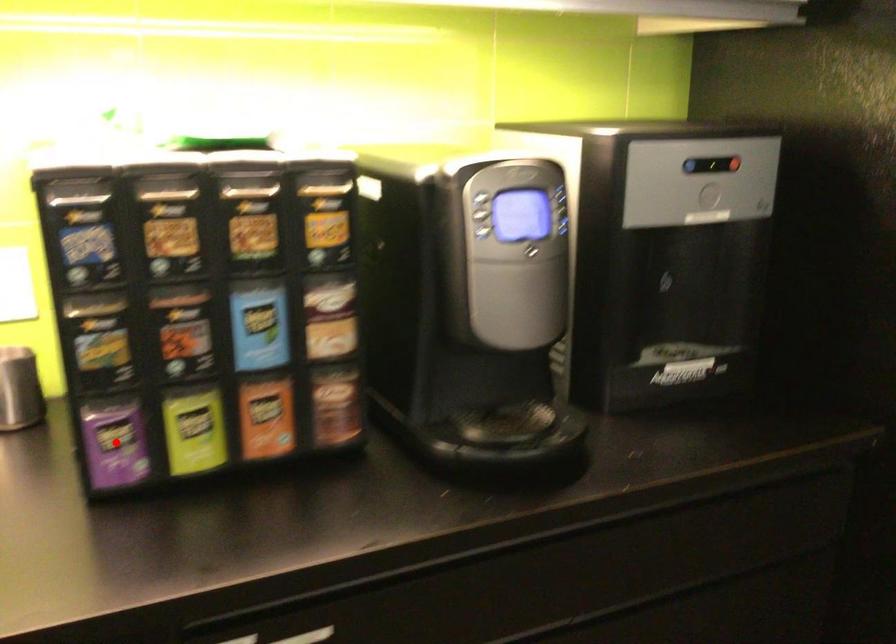
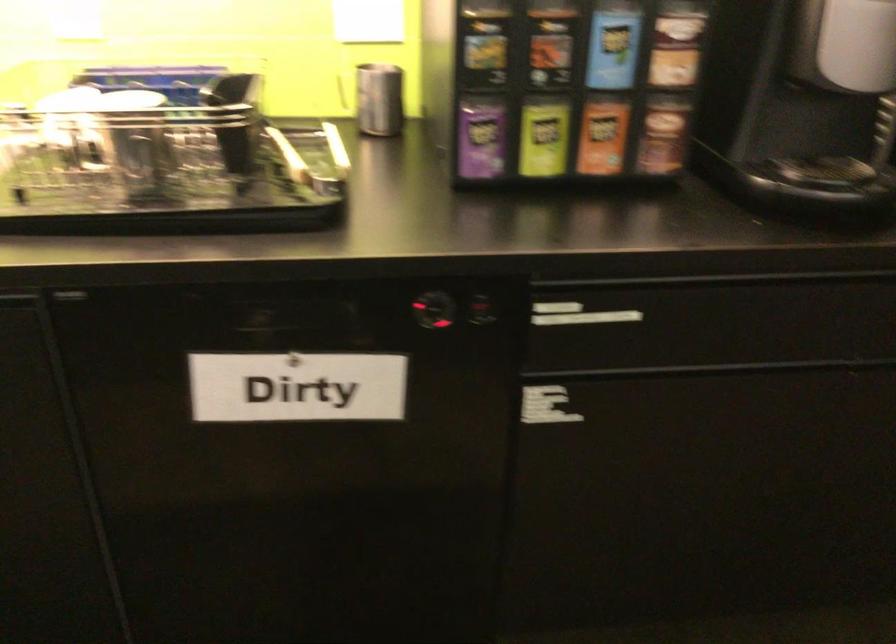
Question: A red point is marked in image1. In image2, is the corresponding 3D point closer to the camera or farther? Reply with the corresponding letter.

Choices:
 (A) The corresponding 3D point is closer.
 (B) The corresponding 3D point is farther.

Answer: (B)